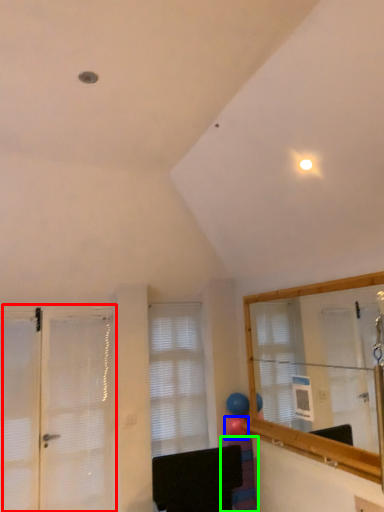
Question: Estimate the real-world distances between objects in this image. Which object is farther from door (highlighted by a red box), balloon (highlighted by a blue box) or furniture (highlighted by a green box)?

Choices:
 (A) balloon
 (B) furniture

Answer: (A)